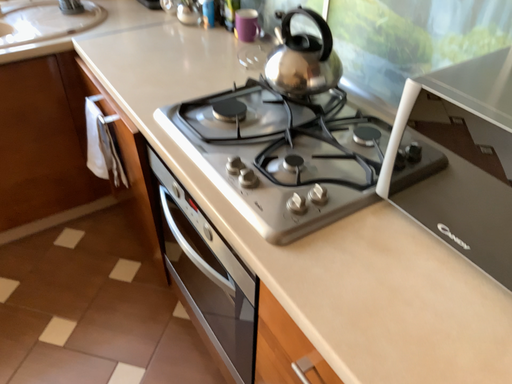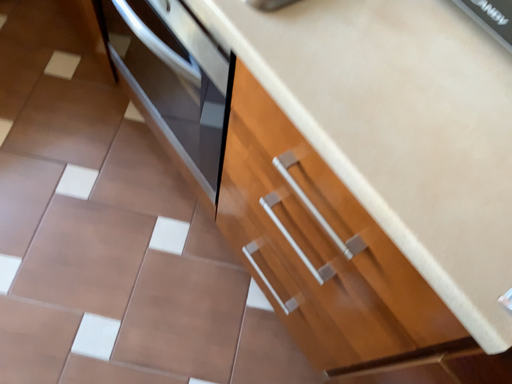
Question: How did the camera likely rotate when shooting the video?

Choices:
 (A) rotated downward
 (B) rotated upward

Answer: (A)